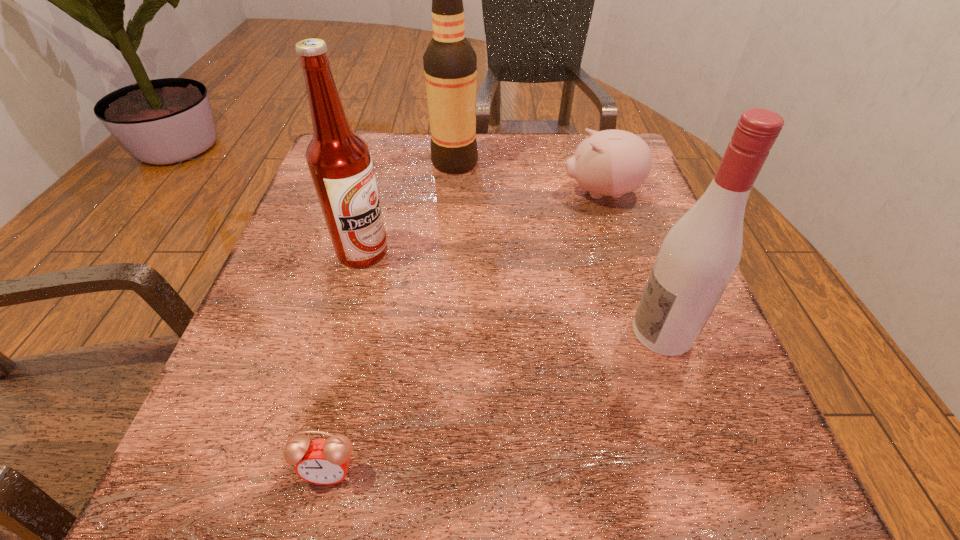
I want to click on unoccupied position between the piggy bank and the third object from left to right, so click(528, 178).

Identify the location of free area in between the second nearest object and the leftmost alcohol. This screenshot has height=540, width=960. (513, 292).

Locate which object is the second closest to the rightmost alcohol. Please provide its 2D coordinates. Your answer should be formatted as a tuple, i.e. [(x, y)], where the tuple contains the x and y coordinates of a point satisfying the conditions above.

[(322, 461)]

Locate an element on the screen. This screenshot has height=540, width=960. object that is the closest to the alarm clock is located at coordinates (339, 161).

Identify which alcohol is the nearest to the farthest object. Please provide its 2D coordinates. Your answer should be formatted as a tuple, i.e. [(x, y)], where the tuple contains the x and y coordinates of a point satisfying the conditions above.

[(339, 161)]

At what (x,y) coordinates should I click in order to perform the action: click on the second closest alcohol relative to the farthest object. Please return your answer as a coordinate pair (x, y). This screenshot has height=540, width=960. Looking at the image, I should click on (699, 255).

Identify the location of free space that satisfies the following two spatial constraints: 1. at the snout of the piggy bank; 2. on the clock face of the nearest object. This screenshot has width=960, height=540. pos(691,471).

Locate an element on the screen. The height and width of the screenshot is (540, 960). vacant space that satisfies the following two spatial constraints: 1. at the snout of the piggy bank; 2. on the clock face of the alarm clock is located at coordinates (691, 471).

At what (x,y) coordinates should I click in order to perform the action: click on vacant area that satisfies the following two spatial constraints: 1. on the label of the fourth farthest object; 2. on the clock face of the nearest object. Please return your answer as a coordinate pair (x, y). This screenshot has height=540, width=960. Looking at the image, I should click on (711, 471).